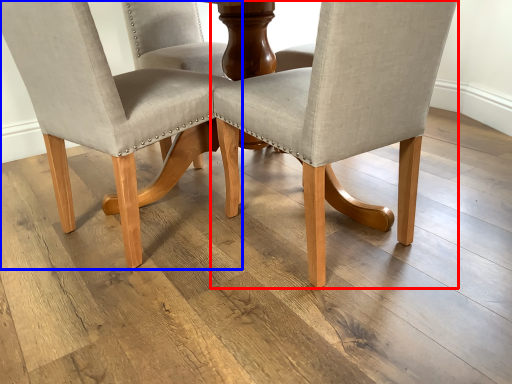
Question: Among these objects, which one is nearest to the camera, chair (highlighted by a red box) or chair (highlighted by a blue box)?

Choices:
 (A) chair
 (B) chair

Answer: (A)